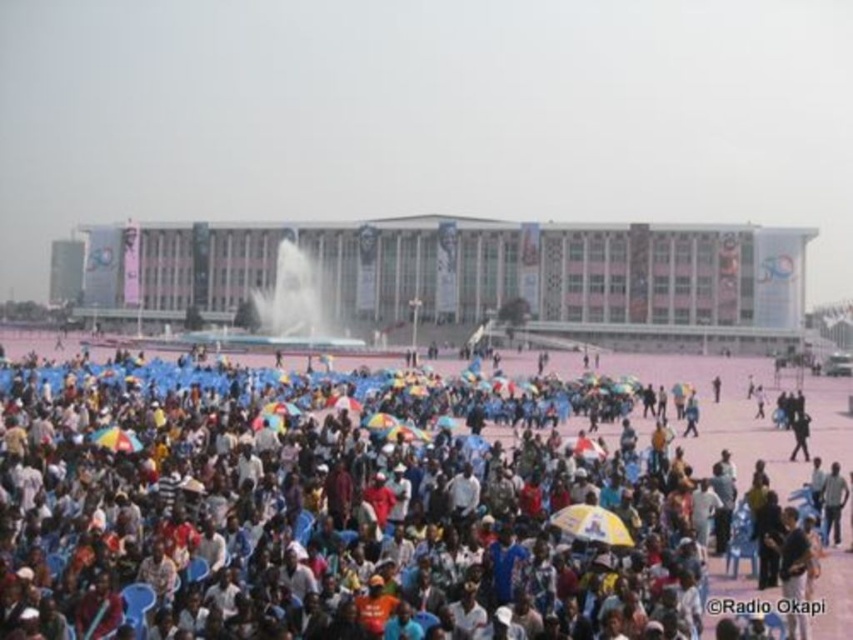
Can you confirm if pink concrete plaza at center is positioned to the right of white frothy water at center?

Correct, you'll find pink concrete plaza at center to the right of white frothy water at center.

Is point (177, 266) positioned after point (320, 291)?

Yes, point (177, 266) is behind point (320, 291).

Locate an element on the screen. This screenshot has height=640, width=853. pink concrete plaza at center is located at coordinates (465, 275).

Identify the location of pink concrete plaza at center. The width and height of the screenshot is (853, 640). (465, 275).

Who is more distant from viewer, (708, 456) or (598, 538)?

The point (708, 456) is behind.

Between blue fabric umbrellas at lower center and yellowmaterial/textureumbrella at center, which one has more height?

Standing taller between the two is blue fabric umbrellas at lower center.

Between point (830, 595) and point (583, 532), which one is positioned behind?

The point (583, 532) is more distant.

I want to click on blue fabric umbrellas at lower center, so click(x=334, y=508).

Between pink concrete plaza at center and yellowmaterial/textureumbrella at center, which one appears on the right side from the viewer's perspective?

Positioned to the right is yellowmaterial/textureumbrella at center.

Based on the photo, does pink concrete plaza at center have a greater width compared to yellowmaterial/textureumbrella at center?

Yes.

Between point (281, 234) and point (592, 538), which one is positioned behind?

The point (281, 234) is more distant.

Find the location of `pink concrete plaza at center`. pink concrete plaza at center is located at coordinates (465, 275).